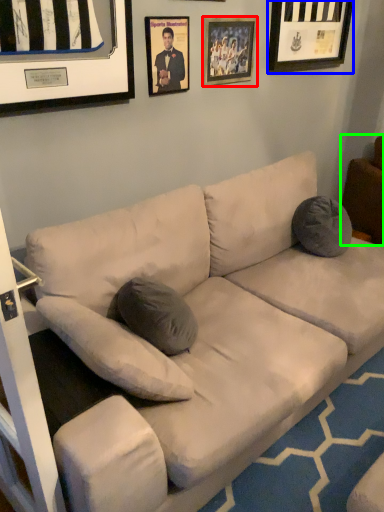
Question: Which object is positioned closest to picture frame (highlighted by a red box)? Select from picture frame (highlighted by a blue box) and furniture (highlighted by a green box).

Choices:
 (A) picture frame
 (B) furniture

Answer: (A)